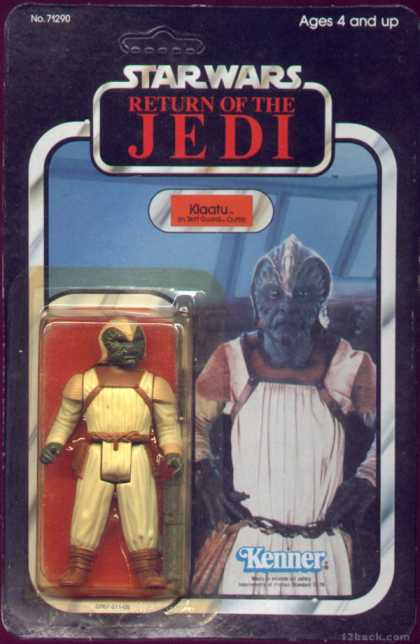
Identify the location of figurine. (118, 366).